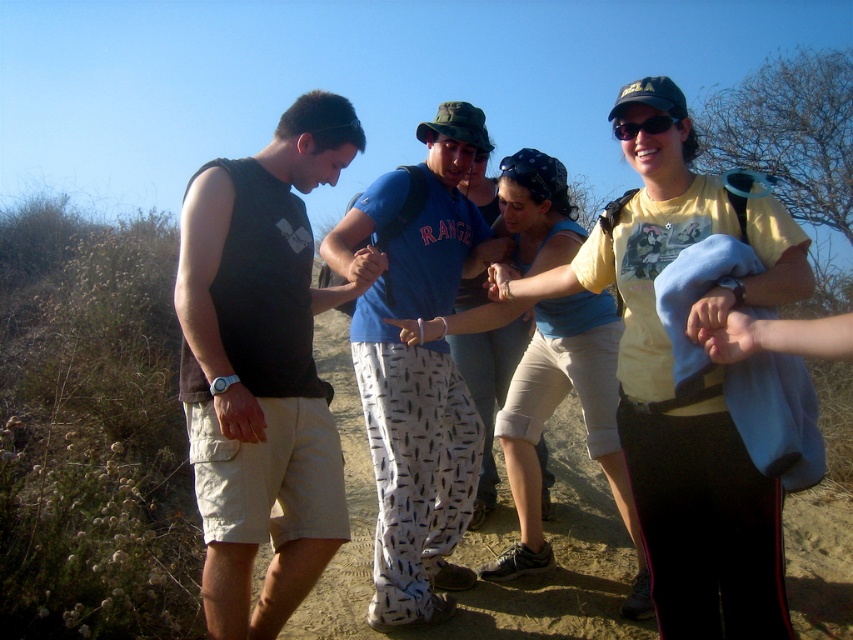
Based on the scene description, where exactly is the matte black tank top at left located in terms of coordinates?

The matte black tank top at left is located at point (x=260, y=365).